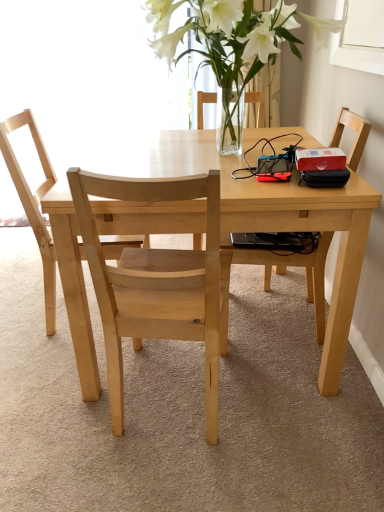
This screenshot has width=384, height=512. I want to click on vacant space in between natural wood chair at center, which is the second chair from left to right, and light wood table at center, so click(238, 416).